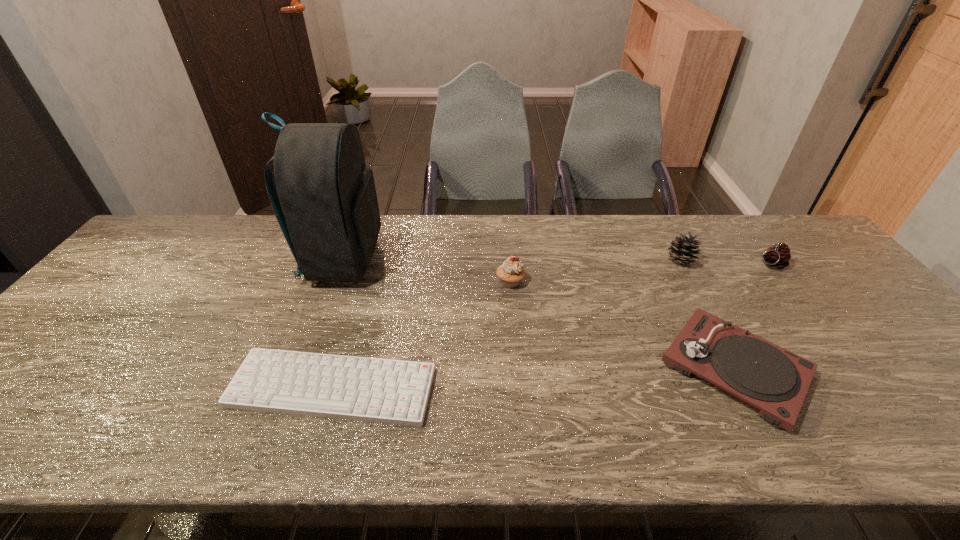
Find the location of a particular element. The height and width of the screenshot is (540, 960). vacant space that satisfies the following two spatial constraints: 1. on the back side of the phonograph_record; 2. on the right side of the computer keyboard is located at coordinates 338,368.